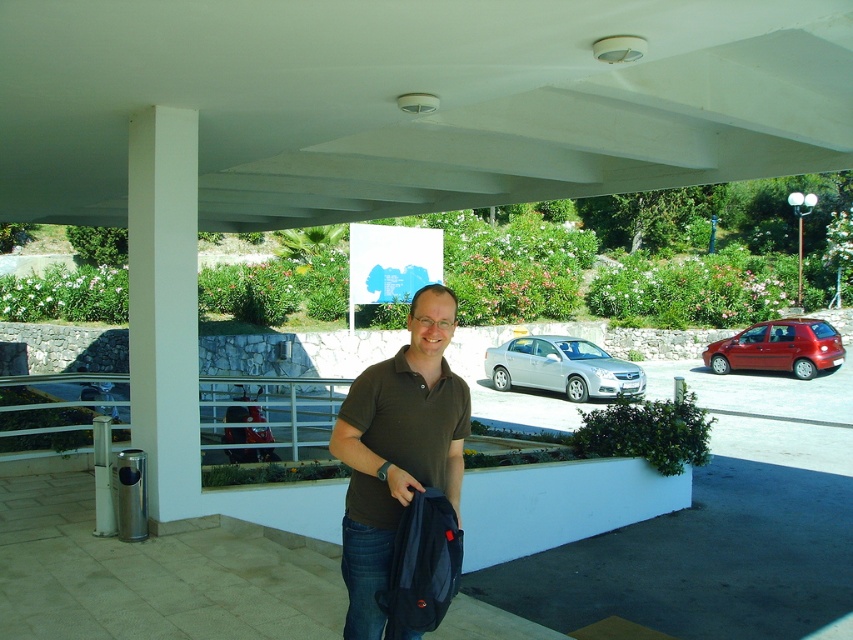
Does point (413, 348) come behind point (448, 554)?

Yes, point (413, 348) is farther from viewer.

Image resolution: width=853 pixels, height=640 pixels. Describe the element at coordinates (397, 452) in the screenshot. I see `brown cotton shirt at center` at that location.

Find the location of a particular element. brown cotton shirt at center is located at coordinates (397, 452).

Does brown cotton shirt at center have a greater height compared to silver metallic sedan at center?

Yes.

Who is shorter, brown cotton shirt at center or silver metallic sedan at center?

Standing shorter between the two is silver metallic sedan at center.

Measure the distance between brown cotton shirt at center and camera.

brown cotton shirt at center is 9.46 feet from camera.

Locate an element on the screen. The width and height of the screenshot is (853, 640). brown cotton shirt at center is located at coordinates (397, 452).

Which is more to the right, dark gray fabric backpack at center or silver metallic sedan at center?

silver metallic sedan at center

Does dark gray fabric backpack at center appear on the right side of silver metallic sedan at center?

No, dark gray fabric backpack at center is not to the right of silver metallic sedan at center.

The height and width of the screenshot is (640, 853). Describe the element at coordinates (422, 564) in the screenshot. I see `dark gray fabric backpack at center` at that location.

The image size is (853, 640). I want to click on dark gray fabric backpack at center, so click(422, 564).